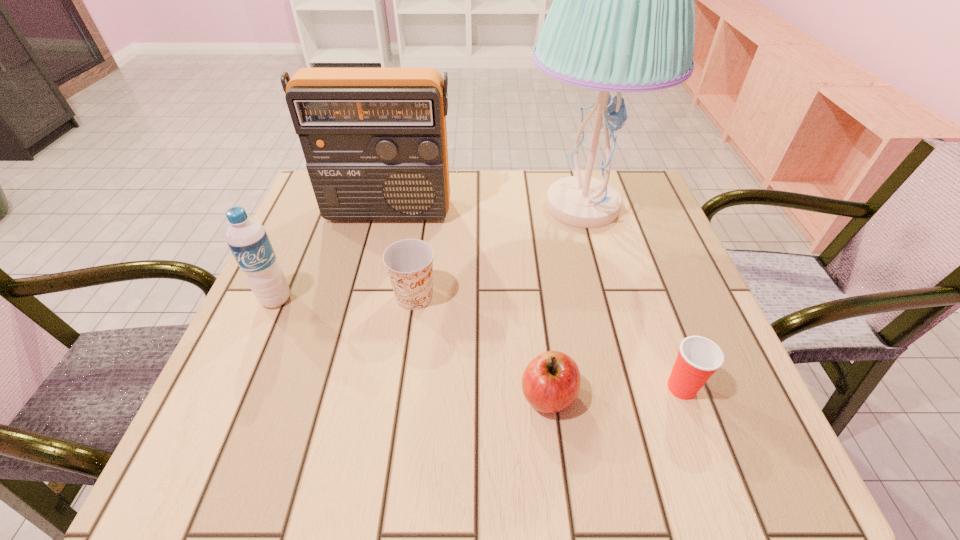
Where is `vacant space located 0.210m on the back of the right Dixie cup`? vacant space located 0.210m on the back of the right Dixie cup is located at coordinates (644, 286).

Find the location of a particular element. The height and width of the screenshot is (540, 960). vacant region located on the right of the apple is located at coordinates pos(701,396).

This screenshot has height=540, width=960. I want to click on lamp located at the far edge, so click(622, 19).

At what (x,y) coordinates should I click in order to perform the action: click on radio receiver that is at the far edge. Please return your answer as a coordinate pair (x, y). This screenshot has width=960, height=540. Looking at the image, I should click on (374, 139).

The width and height of the screenshot is (960, 540). What are the coordinates of `object that is at the near edge` in the screenshot? It's located at (551, 382).

At what (x,y) coordinates should I click in order to perform the action: click on radio receiver at the left edge. Please return your answer as a coordinate pair (x, y). The image size is (960, 540). Looking at the image, I should click on (374, 139).

Identify the location of water bottle that is positioned at the left edge. The height and width of the screenshot is (540, 960). (247, 239).

This screenshot has width=960, height=540. In order to click on lamp that is at the right edge in this screenshot , I will do `click(622, 19)`.

Locate an element on the screen. The height and width of the screenshot is (540, 960). Dixie cup at the right edge is located at coordinates (698, 358).

The height and width of the screenshot is (540, 960). What are the coordinates of `object present at the far left corner` in the screenshot? It's located at (374, 139).